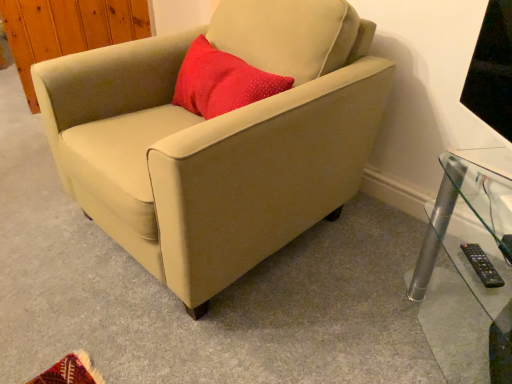
Question: Is clear glass table at lower right oriented towards black plastic remote at lower right?

Choices:
 (A) yes
 (B) no

Answer: (A)

Question: Is clear glass table at lower right positioned behind black plastic remote at lower right?

Choices:
 (A) no
 (B) yes

Answer: (A)

Question: Considering the relative sizes of clear glass table at lower right and black plastic remote at lower right in the image provided, is clear glass table at lower right thinner than black plastic remote at lower right?

Choices:
 (A) no
 (B) yes

Answer: (A)

Question: Is clear glass table at lower right with black plastic remote at lower right?

Choices:
 (A) yes
 (B) no

Answer: (B)

Question: From the image's perspective, is clear glass table at lower right below black plastic remote at lower right?

Choices:
 (A) no
 (B) yes

Answer: (B)

Question: Is black plastic remote at lower right wider or thinner than clear glass table at lower right?

Choices:
 (A) thin
 (B) wide

Answer: (A)

Question: Considering the relative positions of black plastic remote at lower right and clear glass table at lower right in the image provided, is black plastic remote at lower right to the left or to the right of clear glass table at lower right?

Choices:
 (A) right
 (B) left

Answer: (B)

Question: Choose the correct answer: Is black plastic remote at lower right inside clear glass table at lower right or outside it?

Choices:
 (A) outside
 (B) inside

Answer: (B)

Question: Looking at the image, does black plastic remote at lower right seem bigger or smaller compared to clear glass table at lower right?

Choices:
 (A) small
 (B) big

Answer: (A)

Question: Choose the correct answer: Is clear glass table at lower right inside black plastic remote at lower right or outside it?

Choices:
 (A) outside
 (B) inside

Answer: (A)

Question: Is clear glass table at lower right wider or thinner than black plastic remote at lower right?

Choices:
 (A) wide
 (B) thin

Answer: (A)

Question: From the image's perspective, relative to black plastic remote at lower right, is clear glass table at lower right above or below?

Choices:
 (A) above
 (B) below

Answer: (B)

Question: Is clear glass table at lower right taller or shorter than black plastic remote at lower right?

Choices:
 (A) short
 (B) tall

Answer: (B)

Question: Considering their positions, is beige fabric chair at center located in front of or behind black plastic remote at lower right?

Choices:
 (A) behind
 (B) front

Answer: (B)

Question: Does point (187, 296) appear closer or farther from the camera than point (484, 283)?

Choices:
 (A) closer
 (B) farther

Answer: (B)